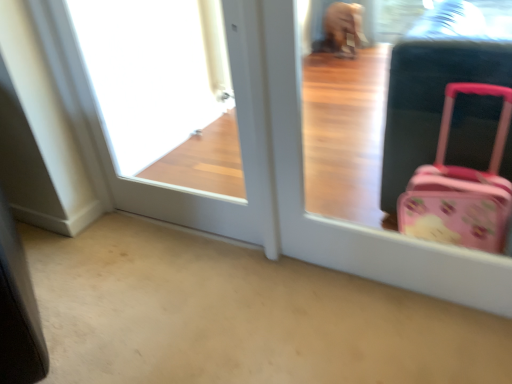
Question: Could you tell me if pink plastic suitcase at right is turned towards white glossy door at upper left?

Choices:
 (A) no
 (B) yes

Answer: (A)

Question: Does pink plastic suitcase at right appear on the right side of white glossy door at upper left?

Choices:
 (A) no
 (B) yes

Answer: (B)

Question: Is pink plastic suitcase at right wider than white glossy door at upper left?

Choices:
 (A) no
 (B) yes

Answer: (B)

Question: Can you confirm if pink plastic suitcase at right is smaller than white glossy door at upper left?

Choices:
 (A) no
 (B) yes

Answer: (B)

Question: Are pink plastic suitcase at right and white glossy door at upper left beside each other?

Choices:
 (A) no
 (B) yes

Answer: (A)

Question: From the image's perspective, would you say pink plastic suitcase at right is shown under white glossy door at upper left?

Choices:
 (A) yes
 (B) no

Answer: (A)

Question: Is white glossy door at upper left outside pink plastic suitcase at right?

Choices:
 (A) no
 (B) yes

Answer: (B)

Question: Is white glossy door at upper left oriented towards pink plastic suitcase at right?

Choices:
 (A) no
 (B) yes

Answer: (A)

Question: Can you confirm if white glossy door at upper left is positioned to the right of pink plastic suitcase at right?

Choices:
 (A) no
 (B) yes

Answer: (A)

Question: Is white glossy door at upper left in front of pink plastic suitcase at right?

Choices:
 (A) no
 (B) yes

Answer: (A)

Question: Does white glossy door at upper left have a greater width compared to pink plastic suitcase at right?

Choices:
 (A) yes
 (B) no

Answer: (B)

Question: Does white glossy door at upper left have a smaller size compared to pink plastic suitcase at right?

Choices:
 (A) no
 (B) yes

Answer: (A)

Question: Choose the correct answer: Is white glossy door at upper left inside pink plastic suitcase at right or outside it?

Choices:
 (A) outside
 (B) inside

Answer: (A)